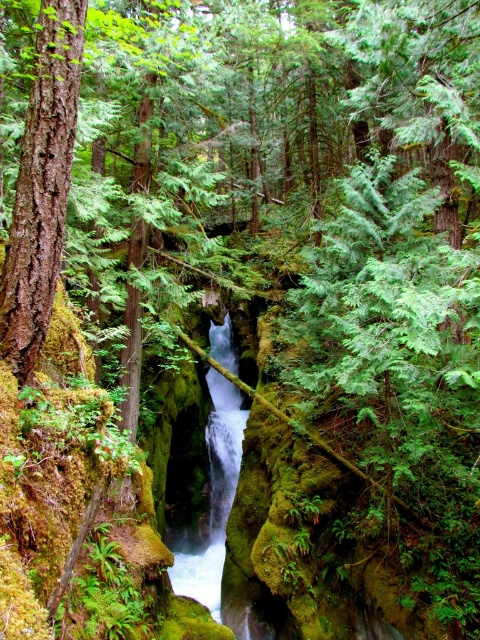
You are a hiker trying to cross the white glossy stream at center. You notice the smooth brown bark at left nearby. Which object takes up more area in the scene?

The white glossy stream at center occupies more space than the smooth brown bark at left, so the stream is larger in area.

You are a hiker who wants to cross the white glossy stream at center. To do so, you need to walk around the smooth brown bark at left. Which direction should you go to reach the stream first?

Since the smooth brown bark at left is closer to the viewer than the white glossy stream at center, you should go around the smooth brown bark at left towards the stream to reach it first.

You are a hiker who wants to cross the white glossy stream at center. There is a fallen tree trunk that is 10 meters long. Can you use the smooth brown bark at left as a support to bridge the gap?

The smooth brown bark at left and white glossy stream at center are 12.09 meters apart from each other. The fallen tree trunk is only 10 meters long, so it is not long enough to bridge the gap between the smooth brown bark at left and the white glossy stream at center. You will need a longer support or alternative path.